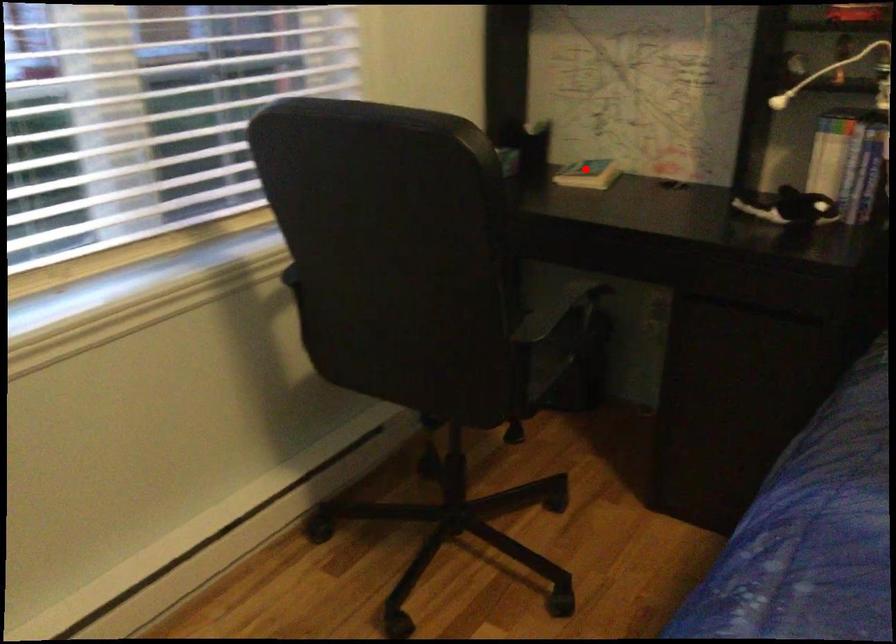
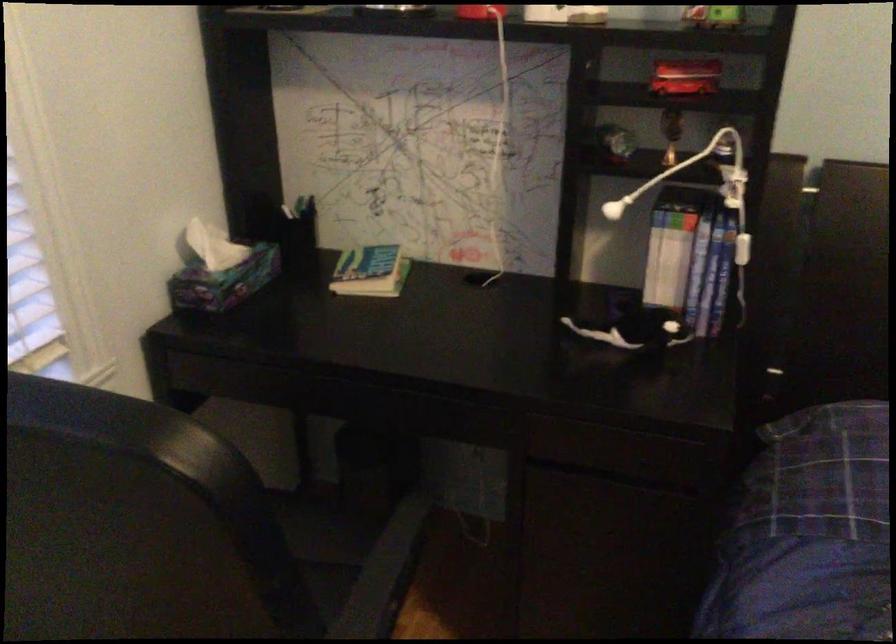
Question: I am providing you with two images of the same scene from different viewpoints. In image1, a red point is highlighted. Considering the same 3D point in image2, which of the following is correct?

Choices:
 (A) It is closer
 (B) It is farther

Answer: (A)